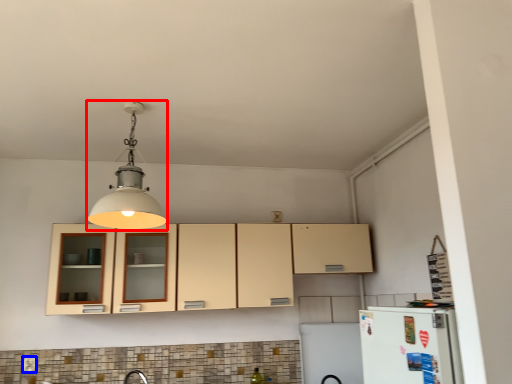
Question: Which object appears farthest to the camera in this image, light fixture (highlighted by a red box) or electric outlet (highlighted by a blue box)?

Choices:
 (A) light fixture
 (B) electric outlet

Answer: (B)